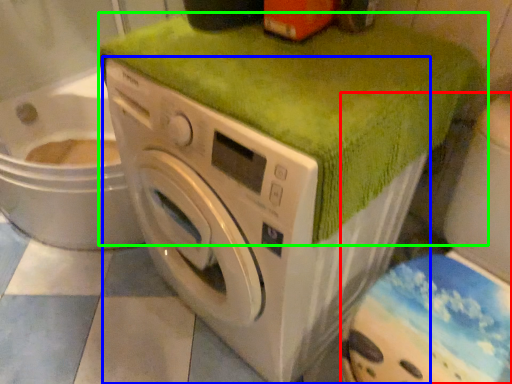
Question: Estimate the real-world distances between objects in this image. Which object is closer to washer (highlighted by a red box), washing machine (highlighted by a blue box) or bath towel (highlighted by a green box)?

Choices:
 (A) washing machine
 (B) bath towel

Answer: (A)